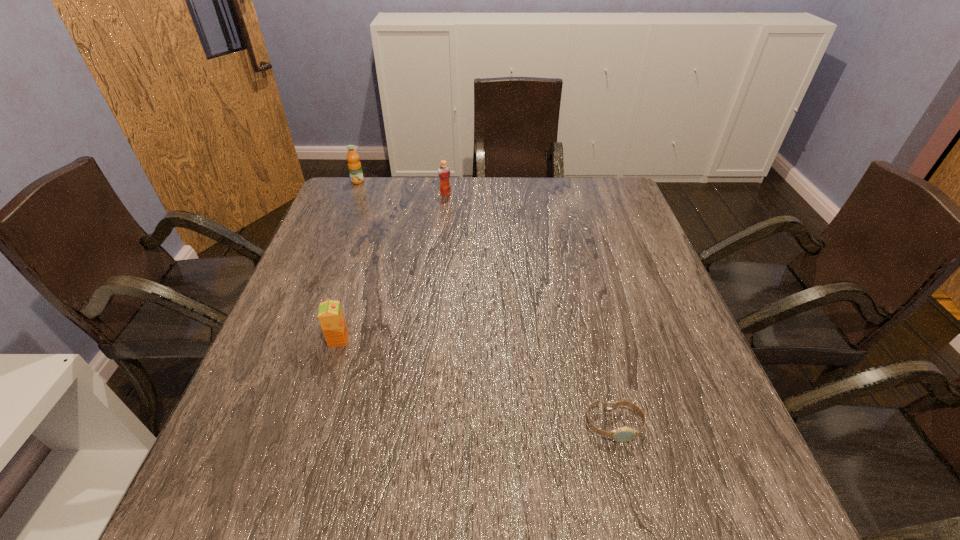
The width and height of the screenshot is (960, 540). Find the location of `free location located 0.340m on the right of the third object from right to left`. free location located 0.340m on the right of the third object from right to left is located at coordinates (504, 340).

You are a GUI agent. You are given a task and a screenshot of the screen. Output one action in this format:
    pyautogui.click(x=<x>, y=<y>)
    Task: Click on the vacant position located on the face of the watch
    The height and width of the screenshot is (540, 960).
    Given the screenshot: What is the action you would take?
    pyautogui.click(x=634, y=508)

You are a GUI agent. You are given a task and a screenshot of the screen. Output one action in this format:
    pyautogui.click(x=<x>, y=<y>)
    Task: Click on the object that is at the far left corner
    
    Given the screenshot: What is the action you would take?
    pyautogui.click(x=355, y=170)

Where is `free space at the far edge of the desktop`? This screenshot has height=540, width=960. free space at the far edge of the desktop is located at coordinates (394, 185).

Locate an element on the screen. The height and width of the screenshot is (540, 960). vacant area at the near edge of the desktop is located at coordinates (360, 495).

You are a GUI agent. You are given a task and a screenshot of the screen. Output one action in this format:
    pyautogui.click(x=<x>, y=<y>)
    Task: Click on the vacant space at the left edge of the desktop
    
    Given the screenshot: What is the action you would take?
    pyautogui.click(x=337, y=266)

Where is `blank area at the right edge`? This screenshot has width=960, height=540. blank area at the right edge is located at coordinates (616, 328).

This screenshot has width=960, height=540. What are the coordinates of `vacant space at the far left corner of the desktop` in the screenshot? It's located at (351, 205).

In the image, there is a desktop. Where is `vacant space at the near left corner`? The image size is (960, 540). vacant space at the near left corner is located at coordinates (221, 477).

At what (x,y) coordinates should I click in order to perform the action: click on vacant space at the far right corner of the desktop. Please return your answer as a coordinate pair (x, y). This screenshot has height=540, width=960. Looking at the image, I should click on (626, 210).